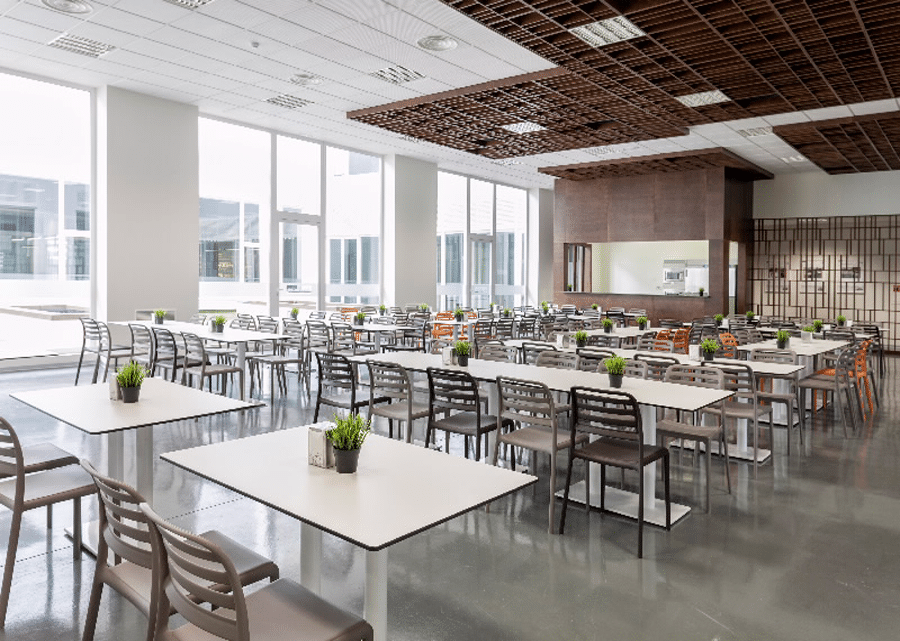
Locate an element on the screen. The image size is (900, 641). tables is located at coordinates (351, 503), (172, 401), (230, 329), (420, 354), (384, 322), (441, 320), (606, 329), (633, 350), (772, 353), (771, 329).